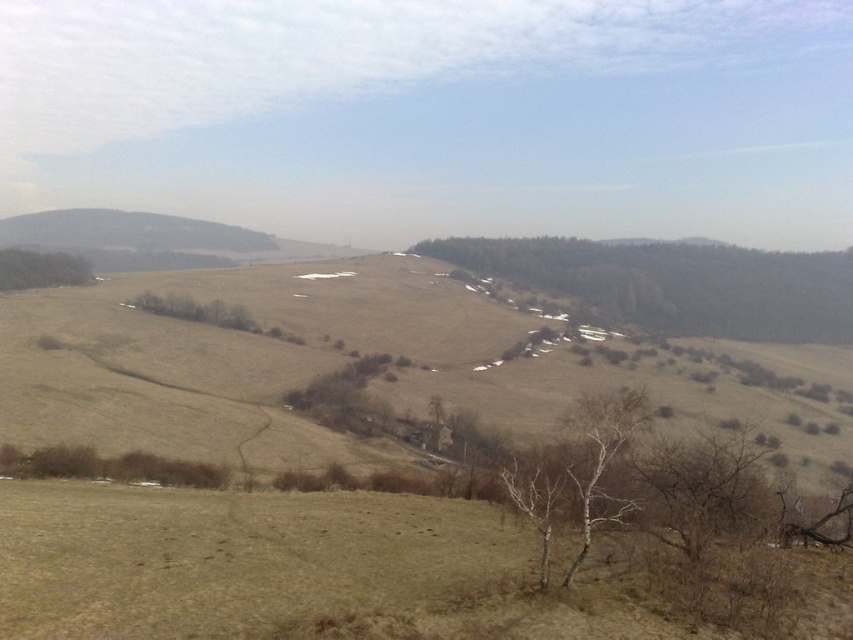
Question: Observing the image, what is the correct spatial positioning of brown textured tree at center in reference to green matte tree at left?

Choices:
 (A) left
 (B) right

Answer: (B)

Question: Is brown textured tree at center positioned before green matte tree at left?

Choices:
 (A) yes
 (B) no

Answer: (B)

Question: Which of the following is the closest to the observer?

Choices:
 (A) (25, 275)
 (B) (699, 294)

Answer: (A)

Question: Among these objects, which one is farthest from the camera?

Choices:
 (A) brown textured tree at center
 (B) green matte tree at left

Answer: (A)

Question: Considering the relative positions of brown textured tree at center and green matte tree at left in the image provided, where is brown textured tree at center located with respect to green matte tree at left?

Choices:
 (A) above
 (B) below

Answer: (A)